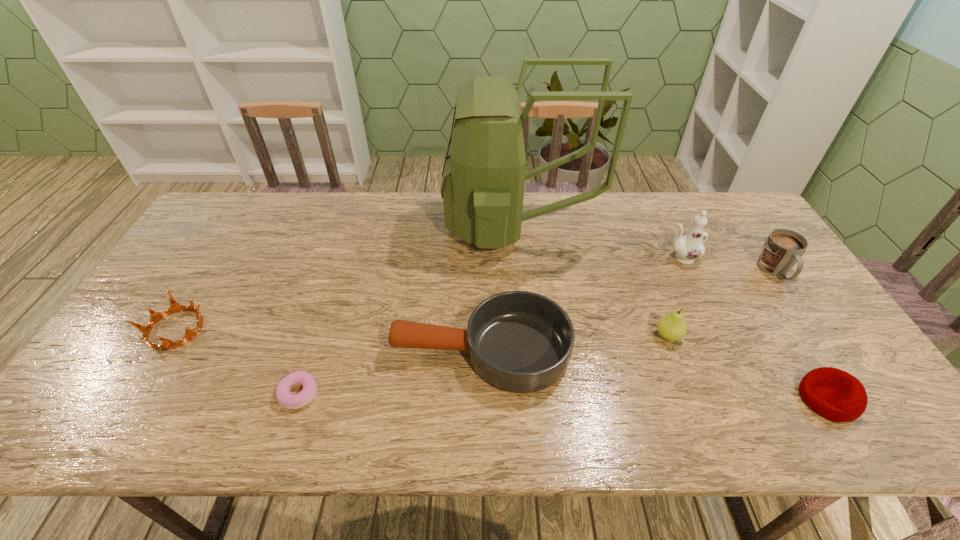
Find the location of a particular element. backpack is located at coordinates (483, 178).

Where is `the second tallest object`? Image resolution: width=960 pixels, height=540 pixels. the second tallest object is located at coordinates (688, 248).

What are the coordinates of `chinaware` in the screenshot? It's located at (688, 248).

Identify the location of mug. This screenshot has width=960, height=540. (783, 248).

Where is `pear`? The image size is (960, 540). pear is located at coordinates (672, 326).

Locate an element on the screen. This screenshot has height=540, width=960. pan is located at coordinates (518, 341).

Where is `beanbag`? beanbag is located at coordinates (836, 395).

Where is `the leftmost object`? This screenshot has height=540, width=960. the leftmost object is located at coordinates (155, 317).

What are the coordinates of `pastry` in the screenshot? It's located at (307, 394).

Identify the location of the shortest object. The height and width of the screenshot is (540, 960). (307, 394).